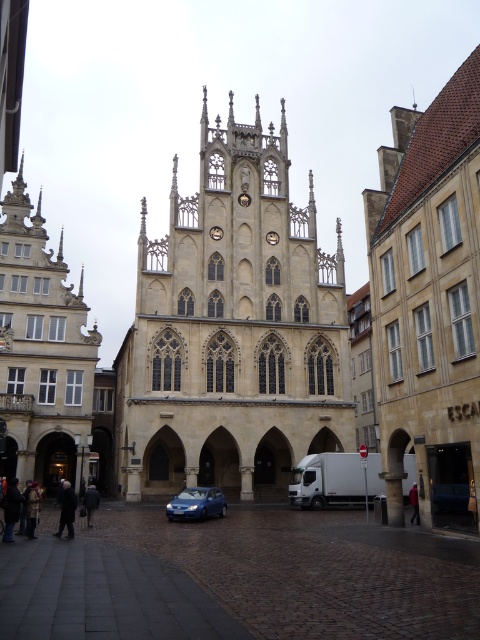
You are standing in the town square facing the Gothic building. There are two points marked on the ground in front of you. One is at point coordinates point (248, 193) and the other at point (4, 506). Which point is closer to your current position?

Point (4, 506) is closer to your current position because it is less further to the camera than point (248, 193).

You are a photographer planning to take a picture of the brown stone church at center and the dark brown leather jacket at lower left. Based on their sizes in the image, which object will appear larger in your photo?

The brown stone church at center will appear larger in the photo because it is taller than the dark brown leather jacket at lower left.

You are a tourist standing in the town square and want to take a photo of the brown stone church at center without any obstructions. However, there is a dark brown leather jacket at lower left in the way. Based on their positions, can you still take the photo without the jacket blocking the church?

The brown stone church at center is in front of the dark brown leather jacket at lower left, so the church will block the view of the jacket. Therefore, you can take a photo of the brown stone church at center without the dark brown leather jacket at lower left obstructing it.